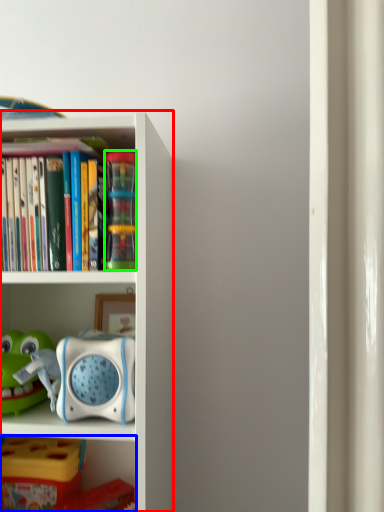
Question: Based on their relative distances, which object is farther from bookcase (highlighted by a red box)? Choose from shelf (highlighted by a blue box) and toy (highlighted by a green box).

Choices:
 (A) shelf
 (B) toy

Answer: (A)